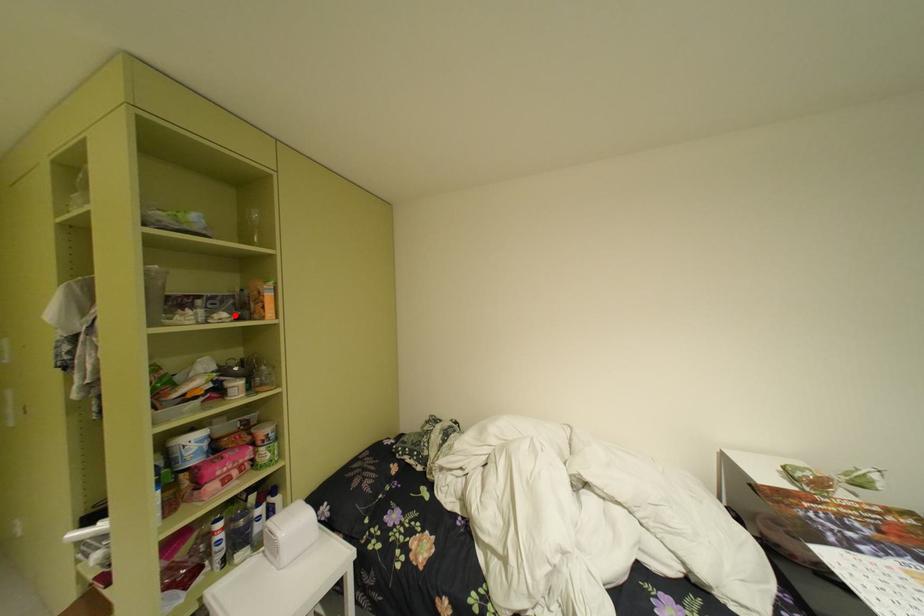
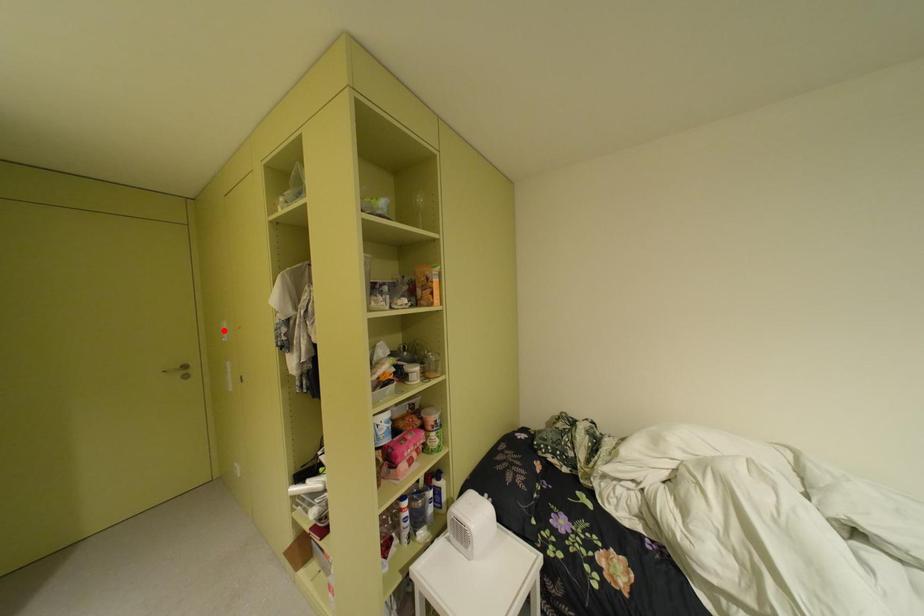
I am providing you with two images of the same scene from different viewpoints. A red point is marked on the first image and another point is marked on the second image. Do the highlighted points in image1 and image2 indicate the same real-world spot?

No